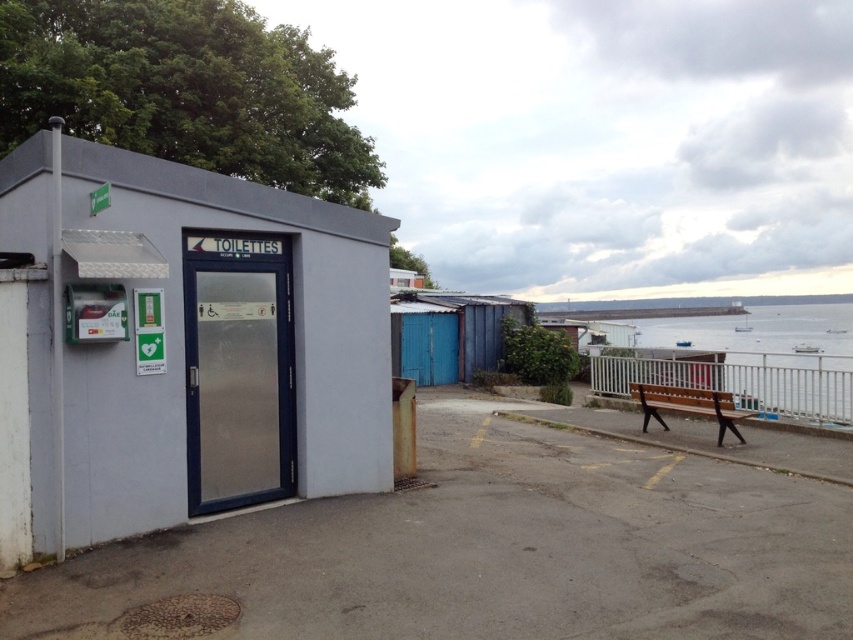
The width and height of the screenshot is (853, 640). What do you see at coordinates (183, 344) in the screenshot?
I see `white matte toilettes at left` at bounding box center [183, 344].

Between white matte toilettes at left and clear water at bench right, which one has more height?

With more height is clear water at bench right.

Is point (96, 401) more distant than point (850, 412)?

No, it is in front of (850, 412).

Find the location of a particular element. The width and height of the screenshot is (853, 640). white matte toilettes at left is located at coordinates (183, 344).

Is point (460, 376) farther from camera compared to point (722, 433)?

Yes, it is.

Does blue corrugated metal shed at center appear on the left side of wooden bench at lower right?

Yes, blue corrugated metal shed at center is to the left of wooden bench at lower right.

Which is in front, point (418, 314) or point (646, 412)?

Point (646, 412) is more forward.

Identify the location of blue corrugated metal shed at center. (451, 333).

Is white matte toilettes at left below wooden bench at lower right?

No, white matte toilettes at left is not below wooden bench at lower right.

Is white matte toilettes at left further to camera compared to wooden bench at lower right?

That is False.

The image size is (853, 640). What do you see at coordinates (183, 344) in the screenshot? I see `white matte toilettes at left` at bounding box center [183, 344].

At what (x,y) coordinates should I click in order to perform the action: click on white matte toilettes at left. Please return your answer as a coordinate pair (x, y). The width and height of the screenshot is (853, 640). Looking at the image, I should click on (183, 344).